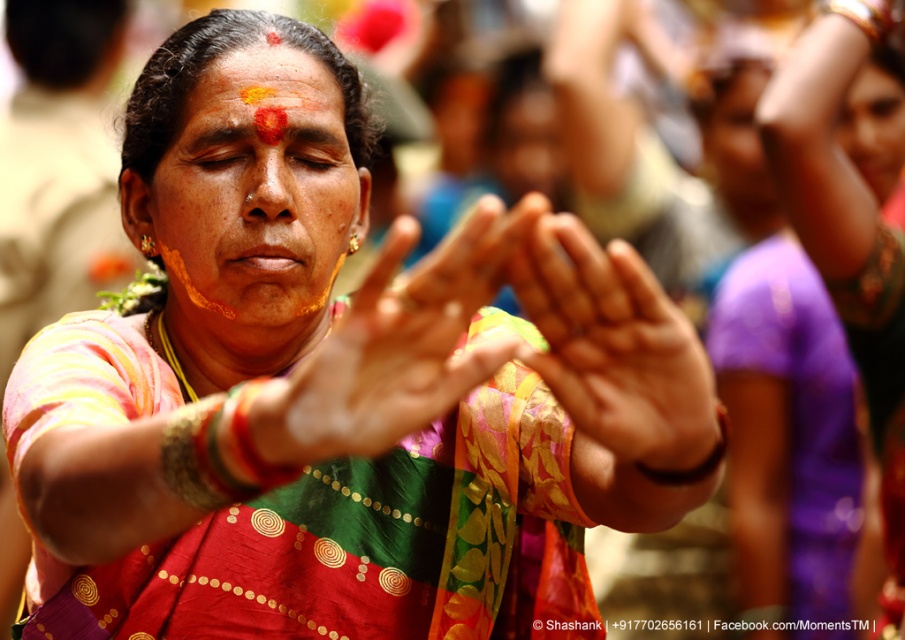
Question: Does matte yellow face at center come behind smooth skin face at upper right?

Choices:
 (A) yes
 (B) no

Answer: (B)

Question: Which object is positioned farthest from the matte orange paste at center?

Choices:
 (A) smooth skin face at upper right
 (B) matte fabric hands at center
 (C) matte yellow face at center

Answer: (A)

Question: Can you confirm if matte fabric hands at center is thinner than smooth skin face at upper right?

Choices:
 (A) no
 (B) yes

Answer: (A)

Question: Does multicolored saree at center come behind smooth skin face at upper right?

Choices:
 (A) no
 (B) yes

Answer: (A)

Question: Which point appears farthest from the camera in this image?

Choices:
 (A) (322, 64)
 (B) (774, 99)
 (C) (293, 97)

Answer: (B)

Question: Which of the following is the closest to the observer?

Choices:
 (A) (627, 291)
 (B) (891, 227)

Answer: (A)